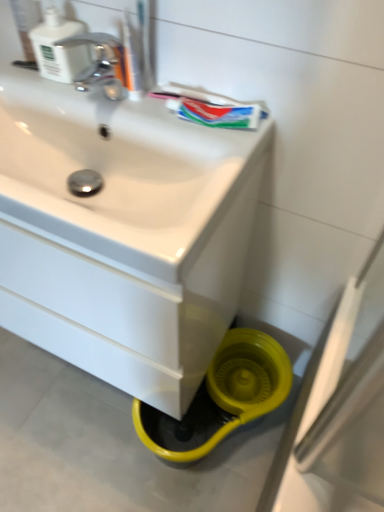
This screenshot has width=384, height=512. What do you see at coordinates (123, 234) in the screenshot? I see `white glossy sink at center` at bounding box center [123, 234].

Describe the element at coordinates (58, 47) in the screenshot. I see `white plastic soap dispenser at upper left` at that location.

I want to click on translucent plastic toothbrush at upper center, so click(145, 42).

Is white plastic soap dispenser at upper left positioned far away from green matte toothpaste at upper center?

They are positioned close to each other.

How much distance is there between white plastic soap dispenser at upper left and green matte toothpaste at upper center?

white plastic soap dispenser at upper left is 10.28 inches away from green matte toothpaste at upper center.

Is white plastic soap dispenser at upper left oriented towards green matte toothpaste at upper center?

No, white plastic soap dispenser at upper left is not oriented towards green matte toothpaste at upper center.

Looking at this image, does white plastic soap dispenser at upper left have a lesser height compared to green matte toothpaste at upper center?

Incorrect, the height of white plastic soap dispenser at upper left does not fall short of that of green matte toothpaste at upper center.

From a real-world perspective, is white glossy sink at center positioned under green matte toothpaste at upper center based on gravity?

Correct, in the physical world, white glossy sink at center is lower than green matte toothpaste at upper center.

Where is `toothpaste that is above the white glossy sink at center (from the image's perspective)`? The image size is (384, 512). toothpaste that is above the white glossy sink at center (from the image's perspective) is located at coordinates (218, 113).

Is the depth of white glossy sink at center less than that of green matte toothpaste at upper center?

Yes, white glossy sink at center is closer to the camera.

Can you confirm if white glossy sink at center is taller than green matte toothpaste at upper center?

Indeed, white glossy sink at center has a greater height compared to green matte toothpaste at upper center.

Looking at this image, is white plastic soap dispenser at upper left to the left of white glossy sink at center from the viewer's perspective?

Correct, you'll find white plastic soap dispenser at upper left to the left of white glossy sink at center.

Is white plastic soap dispenser at upper left positioned in front of white glossy sink at center?

No, white plastic soap dispenser at upper left is further to the viewer.

Considering the sizes of objects white plastic soap dispenser at upper left and white glossy sink at center in the image provided, who is taller, white plastic soap dispenser at upper left or white glossy sink at center?

Standing taller between the two is white glossy sink at center.

From a real-world perspective, is white plastic soap dispenser at upper left positioned over white glossy sink at center based on gravity?

Yes, from a real-world perspective, white plastic soap dispenser at upper left is over white glossy sink at center

Is green matte toothpaste at upper center located outside white plastic soap dispenser at upper left?

Yes, green matte toothpaste at upper center is located beyond the bounds of white plastic soap dispenser at upper left.

Is green matte toothpaste at upper center turned away from white plastic soap dispenser at upper left?

No.

In order to click on toothpaste that is below the white plastic soap dispenser at upper left (from the image's perspective) in this screenshot , I will do `click(218, 113)`.

Which point is more forward, (225, 123) or (65, 80)?

The point (225, 123) is closer.

Between white glossy sink at center and translucent plastic toothbrush at upper center, which one has larger size?

With larger size is white glossy sink at center.

Is white glossy sink at center positioned far away from translucent plastic toothbrush at upper center?

That's not correct — white glossy sink at center is a little close to translucent plastic toothbrush at upper center.

From the image's perspective, which one is positioned lower, white glossy sink at center or translucent plastic toothbrush at upper center?

white glossy sink at center.

Is translucent plastic toothbrush at upper center at the back of white glossy sink at center?

That's not correct — white glossy sink at center is not looking away from translucent plastic toothbrush at upper center.

From a real-world perspective, is green matte toothpaste at upper center positioned above or below translucent plastic toothbrush at upper center?

From a real-world perspective, green matte toothpaste at upper center is physically below translucent plastic toothbrush at upper center.

Is green matte toothpaste at upper center at the left side of translucent plastic toothbrush at upper center?

Incorrect, green matte toothpaste at upper center is not on the left side of translucent plastic toothbrush at upper center.

Which object is wider, green matte toothpaste at upper center or translucent plastic toothbrush at upper center?

green matte toothpaste at upper center.

Does green matte toothpaste at upper center have a greater height compared to translucent plastic toothbrush at upper center?

No.

Is translucent plastic toothbrush at upper center directly adjacent to white glossy sink at center?

No, translucent plastic toothbrush at upper center is not with white glossy sink at center.

Considering the relative sizes of translucent plastic toothbrush at upper center and white glossy sink at center in the image provided, is translucent plastic toothbrush at upper center thinner than white glossy sink at center?

Yes.

Where is `toothbrush above the white glossy sink at center (from a real-world perspective)`? The width and height of the screenshot is (384, 512). toothbrush above the white glossy sink at center (from a real-world perspective) is located at coordinates (145, 42).

Is translucent plastic toothbrush at upper center at the left side of white glossy sink at center?

No.

What are the coordinates of `toothpaste to the right of white plastic soap dispenser at upper left` in the screenshot? It's located at (218, 113).

You are a GUI agent. You are given a task and a screenshot of the screen. Output one action in this format:
    pyautogui.click(x=<x>, y=<y>)
    Task: Click on the toothpaste lying behind the white glossy sink at center
    This screenshot has width=384, height=512.
    Given the screenshot: What is the action you would take?
    pyautogui.click(x=218, y=113)

When comparing their distances from green matte toothpaste at upper center, does translucent plastic toothbrush at upper center or white glossy sink at center seem closer?

Based on the image, translucent plastic toothbrush at upper center appears to be nearer to green matte toothpaste at upper center.

Estimate the real-world distances between objects in this image. Which object is closer to white plastic soap dispenser at upper left, green matte toothpaste at upper center or translucent plastic toothbrush at upper center?

translucent plastic toothbrush at upper center lies closer to white plastic soap dispenser at upper left than the other object.

When comparing their distances from translucent plastic toothbrush at upper center, does green matte toothpaste at upper center or white plastic soap dispenser at upper left seem further?

green matte toothpaste at upper center is further to translucent plastic toothbrush at upper center.

Looking at the image, which one is located further to white plastic soap dispenser at upper left, translucent plastic toothbrush at upper center or white glossy sink at center?

white glossy sink at center is positioned further to the anchor white plastic soap dispenser at upper left.

Looking at the image, which one is located further to green matte toothpaste at upper center, translucent plastic toothbrush at upper center or white plastic soap dispenser at upper left?

Among the two, white plastic soap dispenser at upper left is located further to green matte toothpaste at upper center.

Considering their positions, is white plastic soap dispenser at upper left positioned further to green matte toothpaste at upper center than translucent plastic toothbrush at upper center?

white plastic soap dispenser at upper left is further to green matte toothpaste at upper center.

Based on their spatial positions, is white plastic soap dispenser at upper left or green matte toothpaste at upper center further from white glossy sink at center?

white plastic soap dispenser at upper left.

Looking at the image, which one is located further to green matte toothpaste at upper center, white glossy sink at center or white plastic soap dispenser at upper left?

white glossy sink at center is positioned further to the anchor green matte toothpaste at upper center.

Where is `toothbrush between white plastic soap dispenser at upper left and white glossy sink at center vertically`? The height and width of the screenshot is (512, 384). toothbrush between white plastic soap dispenser at upper left and white glossy sink at center vertically is located at coordinates (145, 42).

Where is `toothpaste between white plastic soap dispenser at upper left and white glossy sink at center from top to bottom`? The image size is (384, 512). toothpaste between white plastic soap dispenser at upper left and white glossy sink at center from top to bottom is located at coordinates (218, 113).

Identify the location of toothbrush between white plastic soap dispenser at upper left and green matte toothpaste at upper center in the horizontal direction. The width and height of the screenshot is (384, 512). (145, 42).

Find the location of a particular element. toothpaste between translucent plastic toothbrush at upper center and white glossy sink at center vertically is located at coordinates point(218,113).